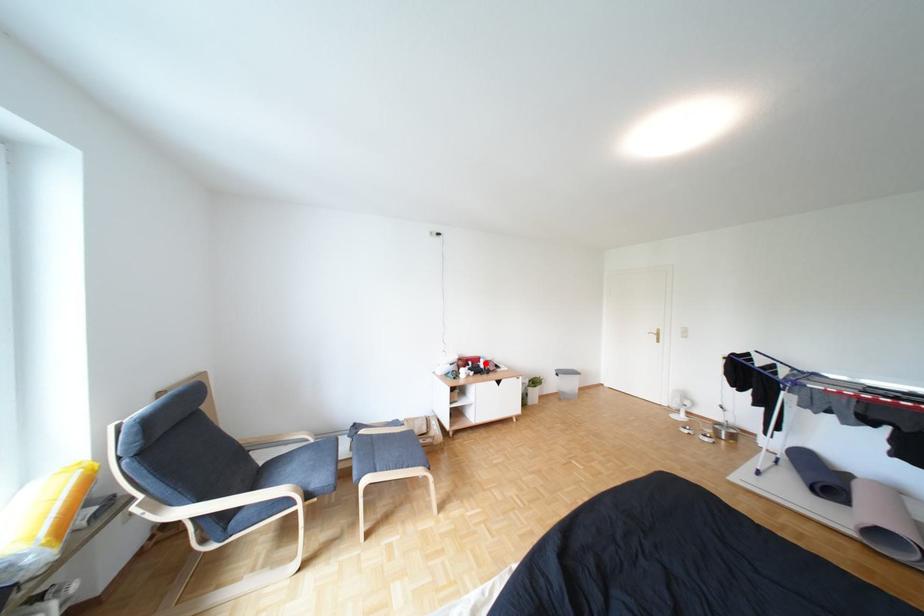
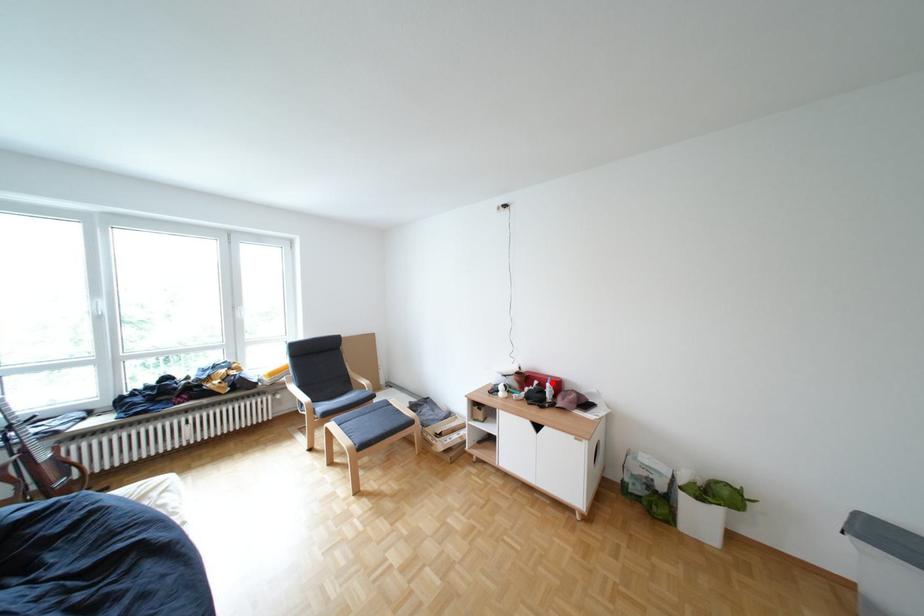
I am providing you with two images of the same scene from different viewpoints. A red point is marked on the first image and another point is marked on the second image. Does the point marked in image1 correspond to the same location as the one in image2?

Yes